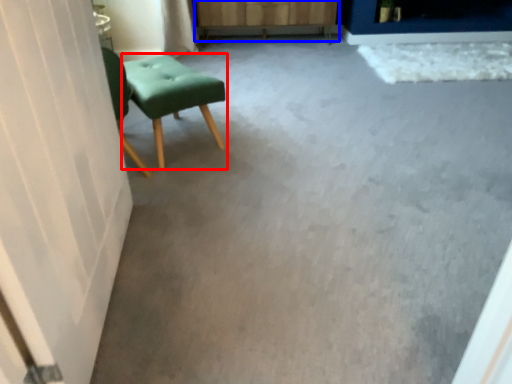
Question: Among these objects, which one is farthest to the camera, stool (highlighted by a red box) or dresser (highlighted by a blue box)?

Choices:
 (A) stool
 (B) dresser

Answer: (B)